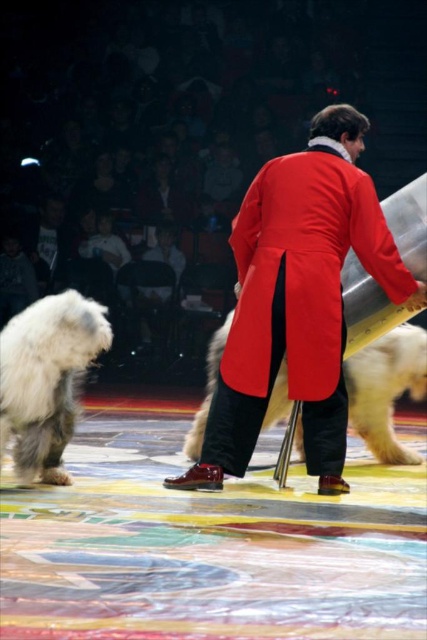
Question: Is shiny red coat at center further to camera compared to white fluffy dog at lower left?

Choices:
 (A) yes
 (B) no

Answer: (A)

Question: Does shiny red coat at center have a smaller size compared to white fluffy dog at center?

Choices:
 (A) yes
 (B) no

Answer: (B)

Question: Does shiny red coat at center have a smaller size compared to white fluffy dog at lower left?

Choices:
 (A) yes
 (B) no

Answer: (B)

Question: Which object appears farthest from the camera in this image?

Choices:
 (A) shiny red coat at center
 (B) white fluffy dog at center
 (C) white fluffy dog at lower left

Answer: (B)

Question: Which object is positioned closest to the white fluffy dog at lower left?

Choices:
 (A) shiny red coat at center
 (B) white fluffy dog at center

Answer: (A)

Question: Considering the real-world distances, which object is farthest from the white fluffy dog at center?

Choices:
 (A) shiny red coat at center
 (B) white fluffy dog at lower left

Answer: (B)